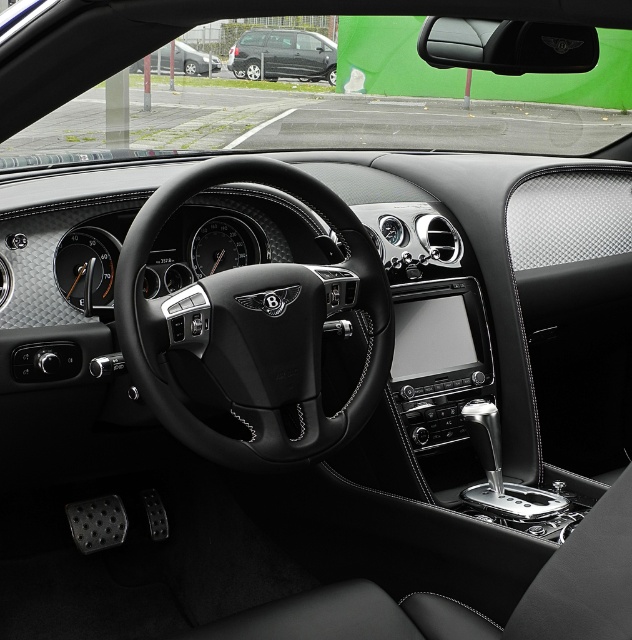
What do you see at coordinates (283, 54) in the screenshot? The width and height of the screenshot is (632, 640). I see `matte black van at center` at bounding box center [283, 54].

Looking at this image, who is more distant from viewer, (298, 51) or (174, 54)?

Positioned behind is point (174, 54).

I want to click on matte black van at center, so click(283, 54).

Which is more to the left, black leather steering wheel at center or matte black car at upper left?

matte black car at upper left is more to the left.

Who is higher up, black leather steering wheel at center or matte black car at upper left?

matte black car at upper left

Is point (368, 282) farther from camera compared to point (154, 52)?

No, (368, 282) is in front of (154, 52).

In order to click on black leather steering wheel at center in this screenshot , I will do `click(253, 326)`.

Is black leather steering wheel at center to the right of matte black van at center from the viewer's perspective?

Indeed, black leather steering wheel at center is positioned on the right side of matte black van at center.

Does black leather steering wheel at center have a larger size compared to matte black van at center?

Indeed, black leather steering wheel at center has a larger size compared to matte black van at center.

Does point (112, 300) lie in front of point (240, 76)?

Yes, point (112, 300) is in front of point (240, 76).

This screenshot has width=632, height=640. What are the coordinates of `black leather steering wheel at center` in the screenshot? It's located at [x=253, y=326].